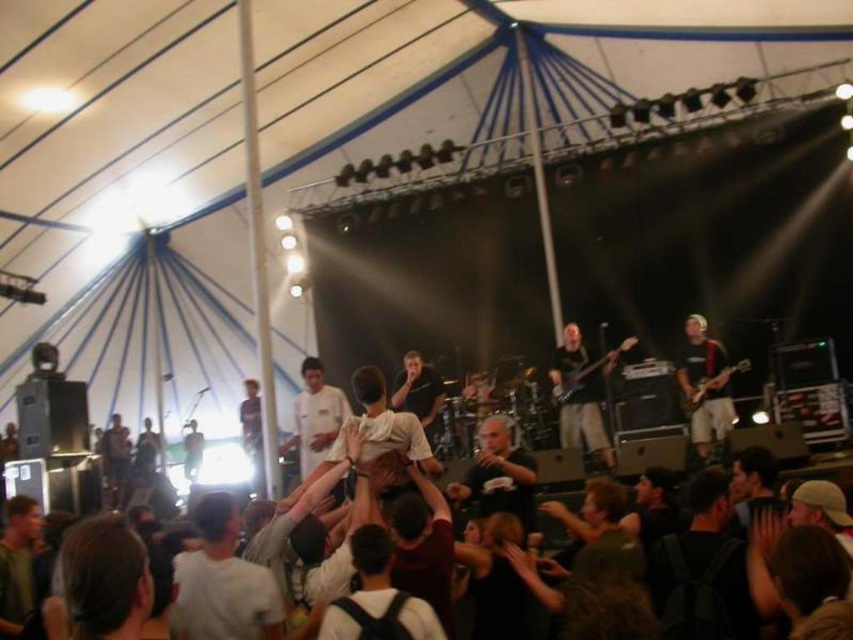
You are a photographer at the concert. You want to capture a closeup shot of the black matte electric guitar at center. The camera you are using has a focal length of 50mm. What is the minimum distance you need to be from the guitar to achieve a full frame shot?

The minimum distance required to achieve a full frame shot of the black matte electric guitar at center with a 50mm lens is approximately 1.16 meters. This is calculated using the formula for minimum focusing distance, which takes into account the sensor size and the desired field of view.